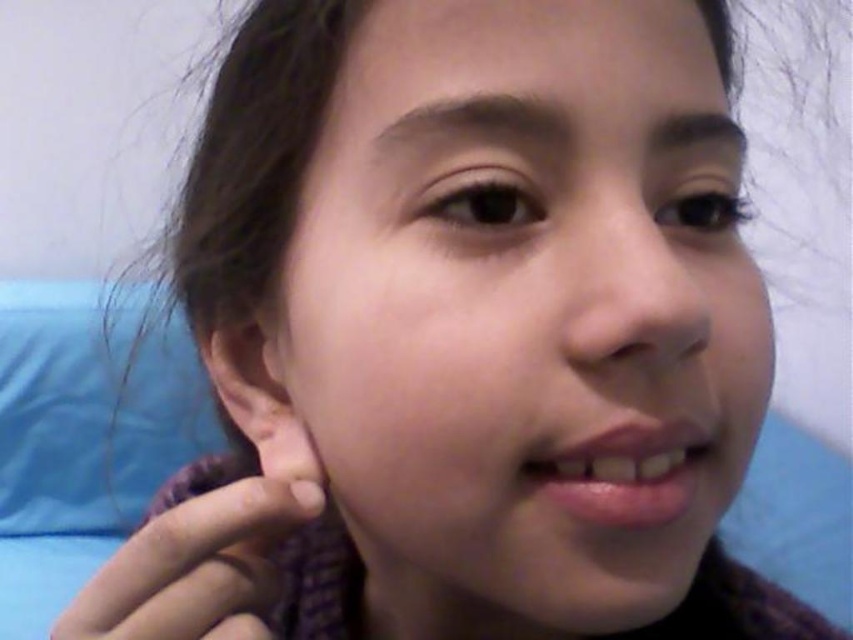
Measure the distance from blue fabric pillow at lower left to purple knitted hand at lower left.

A distance of 1.51 meters exists between blue fabric pillow at lower left and purple knitted hand at lower left.

Between point (102, 422) and point (242, 589), which one is positioned in front?

Point (242, 589) is in front.

Is point (9, 524) farther from camera compared to point (62, 632)?

That is True.

Locate an element on the screen. This screenshot has height=640, width=853. blue fabric pillow at lower left is located at coordinates (91, 406).

Which is more to the right, smooth skin face at center or smooth skin ear at lower left?

smooth skin face at center

At what (x,y) coordinates should I click in order to perform the action: click on smooth skin face at center. Please return your answer as a coordinate pair (x, y). Looking at the image, I should click on (524, 314).

Find the location of a particular element. The width and height of the screenshot is (853, 640). smooth skin face at center is located at coordinates (524, 314).

Who is lower down, smooth skin face at center or purple knitted hand at lower left?

purple knitted hand at lower left is below.

Find the location of `smooth skin face at center`. smooth skin face at center is located at coordinates (524, 314).